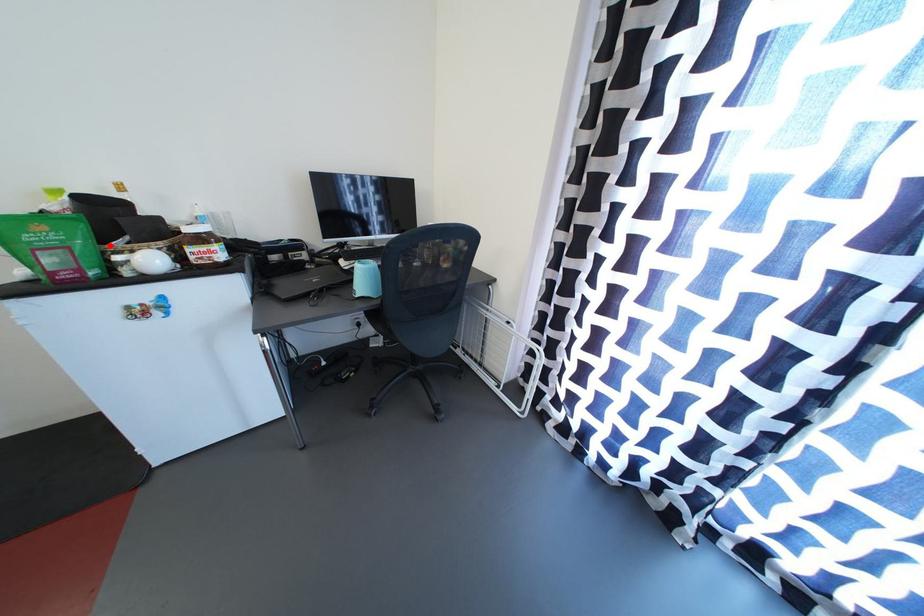
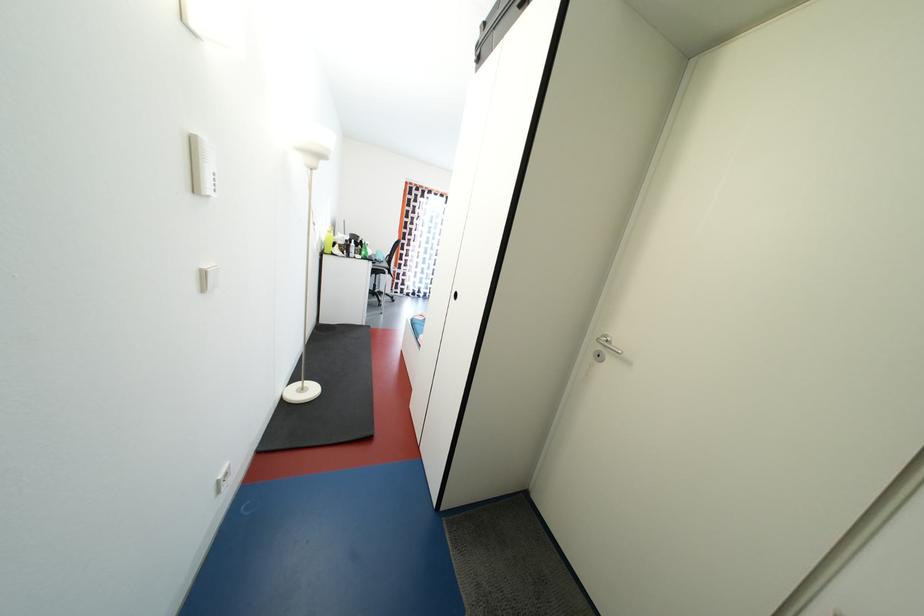
Question: I am providing you with two images of the same scene from different viewpoints. A red point is marked on the first image. Is the red point's position out of view in image 2?

Choices:
 (A) Yes
 (B) No

Answer: (A)